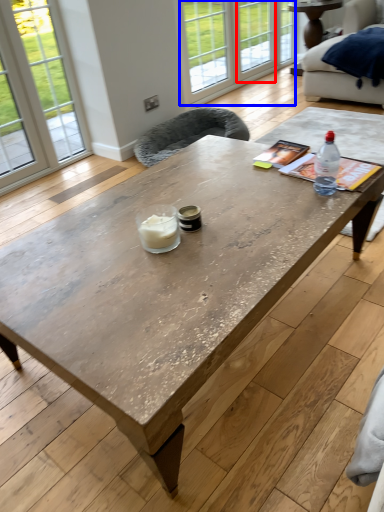
Question: Which of the following is the farthest to the observer, window (highlighted by a red box) or glass door (highlighted by a blue box)?

Choices:
 (A) window
 (B) glass door

Answer: (A)